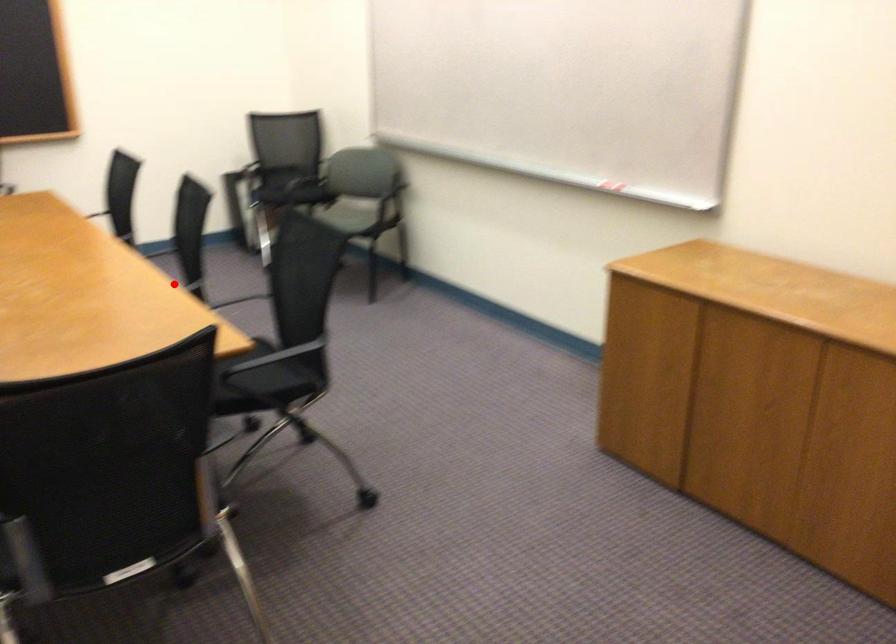
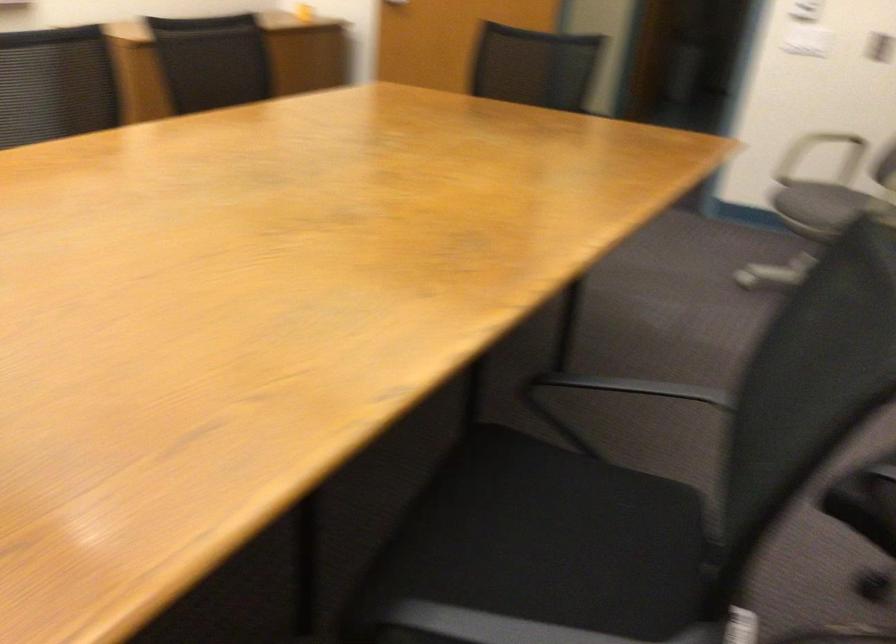
Question: I am providing you with two images of the same scene from different viewpoints. A red point is marked on the first image. Can you still see the location of the red point in image 2?

Choices:
 (A) Yes
 (B) No

Answer: (B)